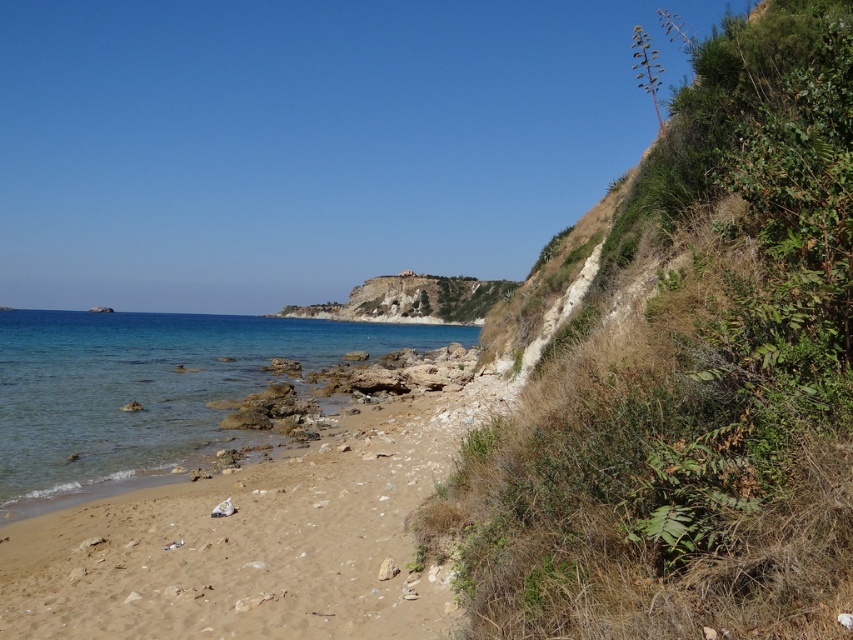
You are standing at the point marked as point (250, 545) in the image. What is the color of the ground beneath your feet?

The point 0.854, 0.294 indicates light brown sandy beach at lower center, so the ground beneath your feet is light brown sandy beach.

You are standing on the light brown sandy beach at lower center and want to walk to the clear blue water at lower left. Which direction should you head to reach the water?

You should head towards the lower left direction to reach the clear blue water at lower left from the light brown sandy beach at lower center.